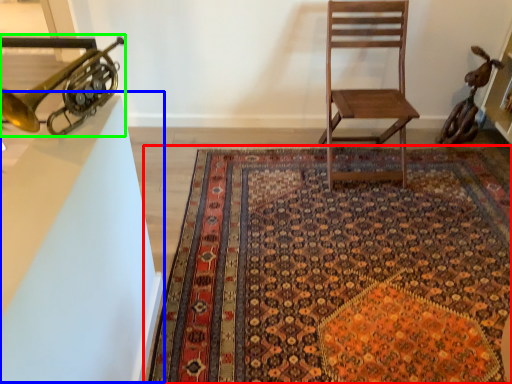
Question: Estimate the real-world distances between objects in this image. Which object is farther from mat (highlighted by a red box), table (highlighted by a blue box) or trumpet (highlighted by a green box)?

Choices:
 (A) table
 (B) trumpet

Answer: (B)